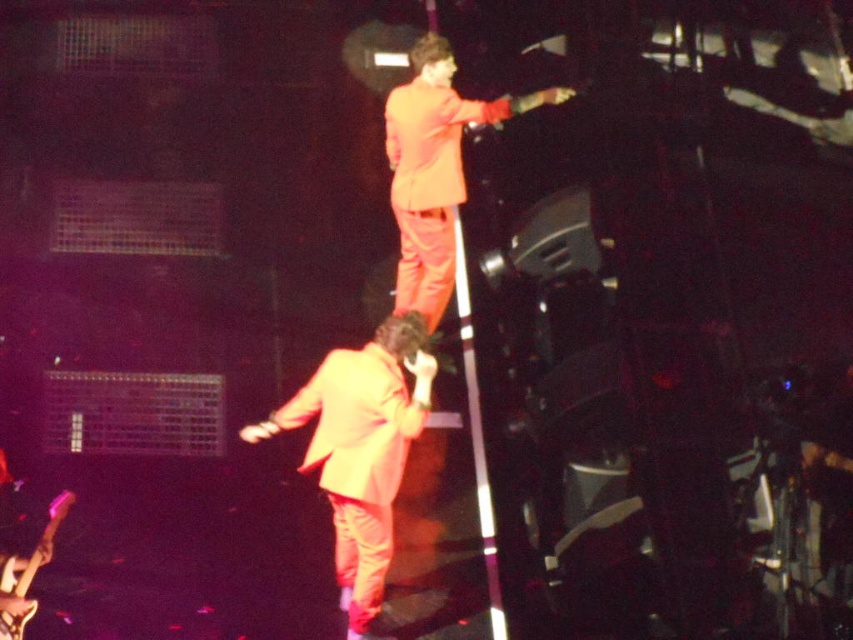
You are a photographer at the concert venue trying to capture a photo of both the orange matte suit at center and the orange matte suit at upper center. Which one is located to the left of the other?

The orange matte suit at center is positioned on the left side of orange matte suit at upper center.

You are a photographer at the concert venue and want to capture a photo that includes both the orange matte suit at center and the orange matte suit at upper center. Based on their sizes in the image, which of the two suits should you focus on to ensure both are clearly visible in the frame?

The orange matte suit at center occupies less space than orange matte suit at upper center, so focusing on the orange matte suit at upper center would allow both to be clearly visible since it takes up more space in the frame.